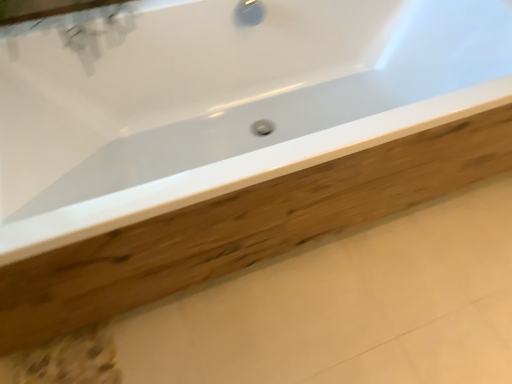
Question: From the image's perspective, is wooden plank at center below white glossy bathtub at center?

Choices:
 (A) no
 (B) yes

Answer: (B)

Question: Can you confirm if wooden plank at center is positioned to the left of white glossy bathtub at center?

Choices:
 (A) no
 (B) yes

Answer: (A)

Question: Can you confirm if wooden plank at center is thinner than white glossy bathtub at center?

Choices:
 (A) yes
 (B) no

Answer: (B)

Question: Is wooden plank at center smaller than white glossy bathtub at center?

Choices:
 (A) no
 (B) yes

Answer: (B)

Question: Would you say wooden plank at center contains white glossy bathtub at center?

Choices:
 (A) no
 (B) yes

Answer: (A)

Question: Is wooden plank at center outside white glossy bathtub at center?

Choices:
 (A) no
 (B) yes

Answer: (B)

Question: Is white glossy bathtub at center next to wooden plank at center?

Choices:
 (A) no
 (B) yes

Answer: (A)

Question: From the image's perspective, does white glossy bathtub at center appear higher than wooden plank at center?

Choices:
 (A) yes
 (B) no

Answer: (A)

Question: Can you confirm if white glossy bathtub at center is taller than wooden plank at center?

Choices:
 (A) no
 (B) yes

Answer: (B)

Question: Is white glossy bathtub at center bigger than wooden plank at center?

Choices:
 (A) no
 (B) yes

Answer: (B)

Question: Does white glossy bathtub at center have a greater width compared to wooden plank at center?

Choices:
 (A) yes
 (B) no

Answer: (B)

Question: Can you confirm if white glossy bathtub at center is shorter than wooden plank at center?

Choices:
 (A) yes
 (B) no

Answer: (B)

Question: Considering the positions of wooden plank at center and white glossy bathtub at center in the image, is wooden plank at center bigger or smaller than white glossy bathtub at center?

Choices:
 (A) big
 (B) small

Answer: (B)